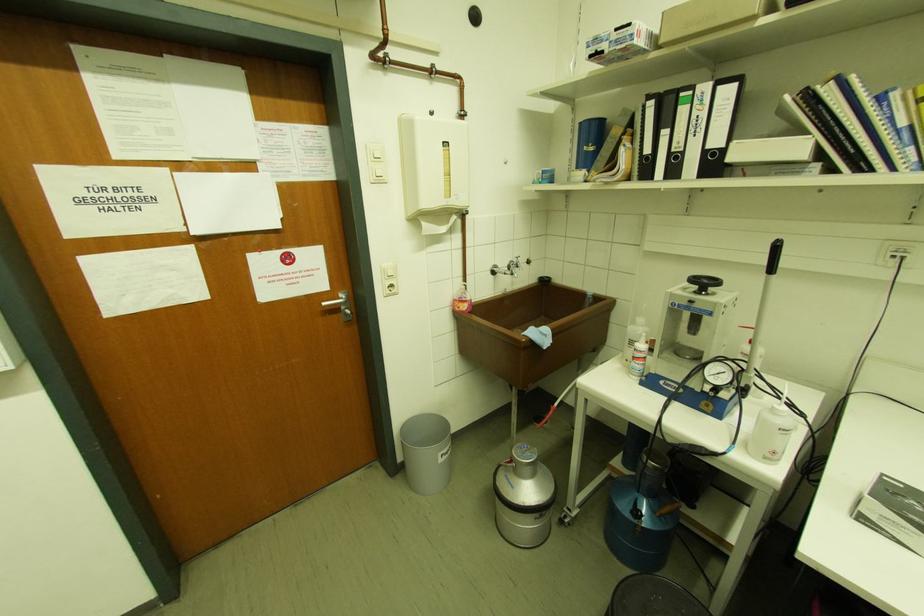
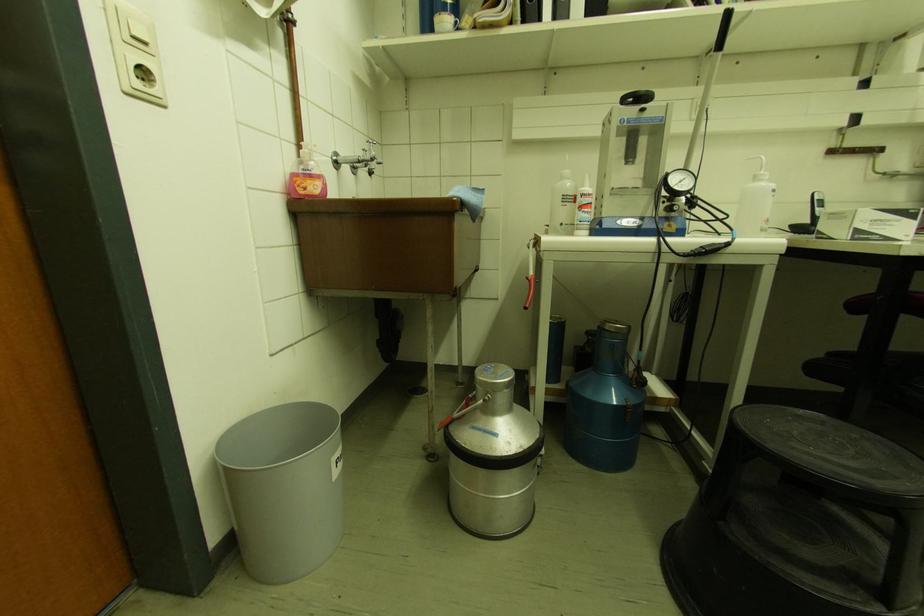
Locate, in the second image, the point that corresponds to (x=697, y=281) in the first image.

(628, 100)